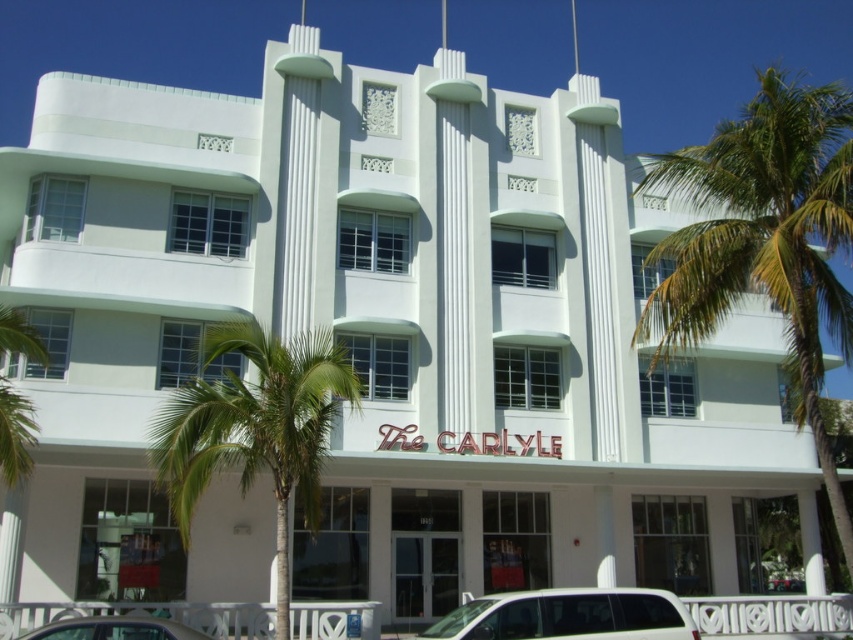
You are standing in front of the Art Deco building and notice two points marked on its facade. The first point is at coordinates point (651, 328) and the second is at point (601, 627). Which point is closer to you?

Point (651, 328) is further to the camera than point (601, 627), so the second point is closer to you.

You are standing in front of the Art Deco building and want to take a photo that includes both the green leafy palm tree at right and the name

The green leafy palm tree at right is located at point (764, 241), so you can position yourself to include both the palm tree and the name

You are standing in front of the Art Deco building and want to take a photo of both the green leafy palm tree at right and the metallic silver car at lower left. Which object should you position to your left side to include both in the frame?

You should position the metallic silver car at lower left to your left side because the green leafy palm tree at right is to the right of the metallic silver car at lower left, so placing the car to your left will allow both to be in the frame with the tree on the right side.